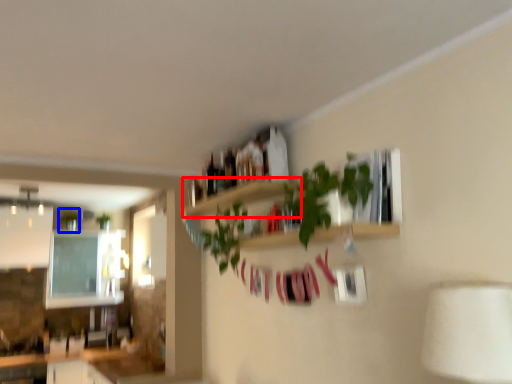
Question: Which object appears closest to the camera in this image, shelf (highlighted by a red box) or plant (highlighted by a blue box)?

Choices:
 (A) shelf
 (B) plant

Answer: (A)